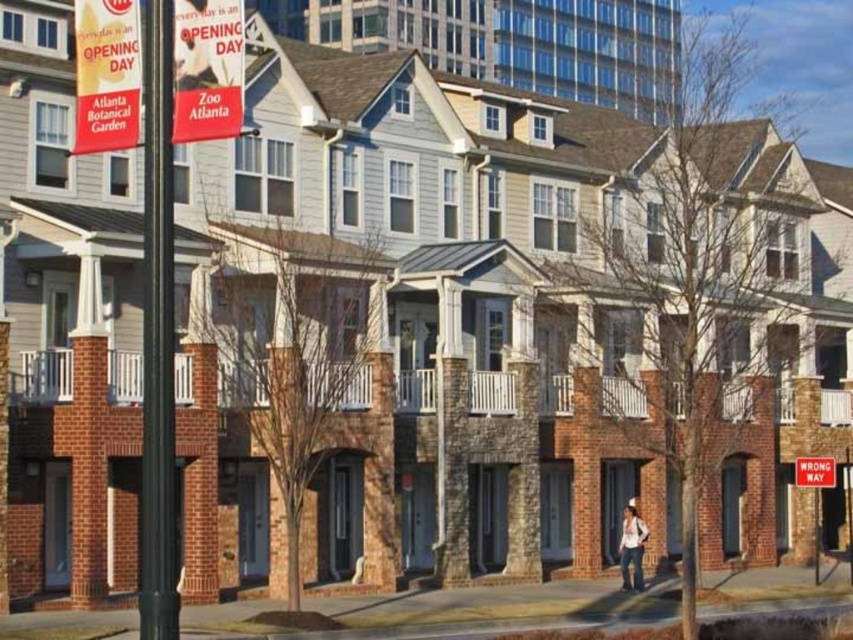
You are a pedestrian walking towards the townhouses and notice both the white cotton shirt at lower right and the wrong way sign at lower right. Which object appears narrower from your perspective?

The white cotton shirt at lower right is thinner than the wrong way sign at lower right, so it appears narrower from your perspective.

You are standing at the center of the townhouse row and want to take a photo of the white cotton shirt at lower right. In which direction should you move to get it into the frame?

The white cotton shirt at lower right is located at coordinate point (631, 548), so you should move towards the lower right direction to center it in your frame.